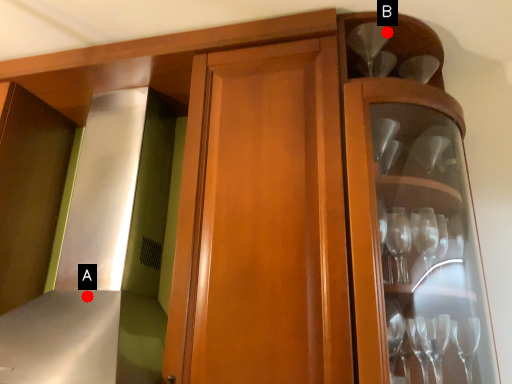
Question: Two points are circled on the image, labeled by A and B beside each circle. Among these points, which one is farthest from the camera?

Choices:
 (A) A is further
 (B) B is further

Answer: (A)